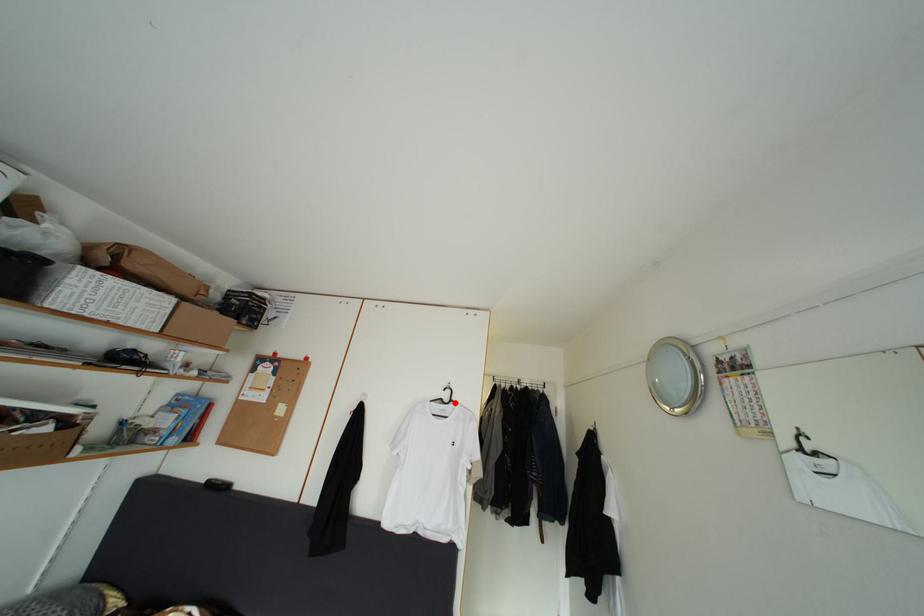
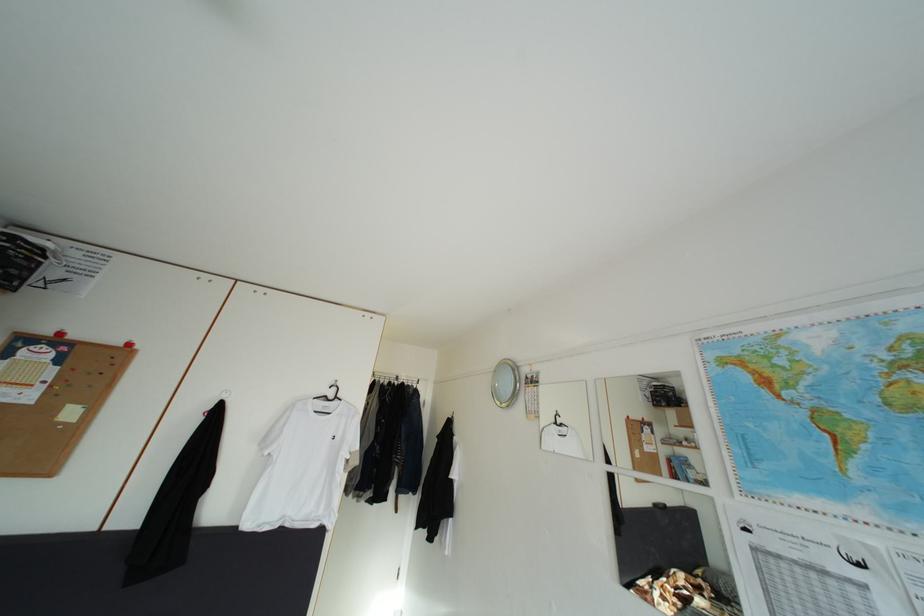
In the second image, find the point that corresponds to the highlighted location in the first image.

(339, 400)